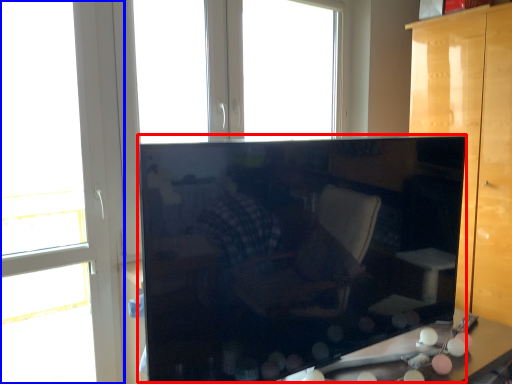
Question: Which object is further to the camera taking this photo, cabinetry (highlighted by a red box) or window (highlighted by a blue box)?

Choices:
 (A) cabinetry
 (B) window

Answer: (B)